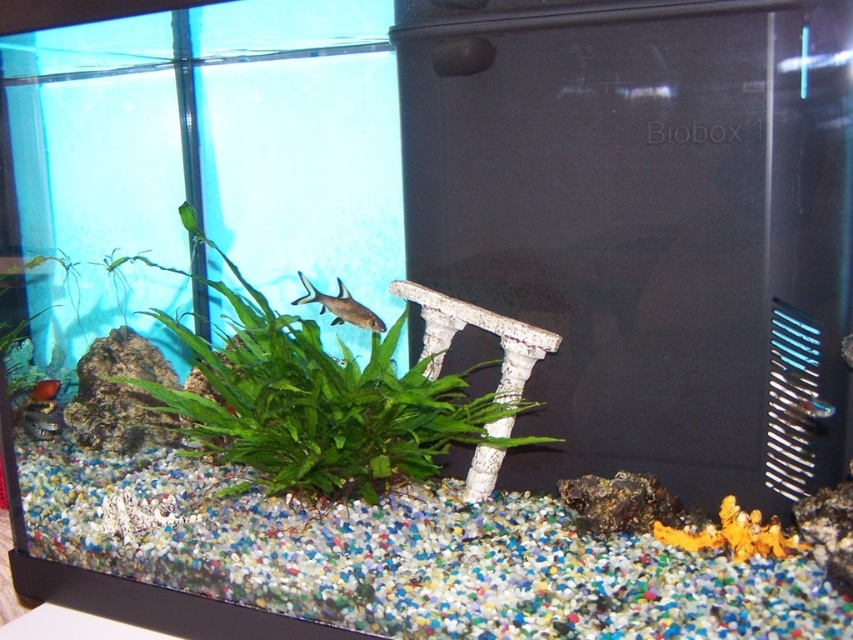
Who is higher up, green leafy plant at center or shiny silver fish at center?

shiny silver fish at center is higher up.

Which of these two, green leafy plant at center or shiny silver fish at center, stands taller?

green leafy plant at center

Between point (392, 385) and point (325, 307), which one is positioned in front?

Positioned in front is point (392, 385).

Where is `green leafy plant at center`? The height and width of the screenshot is (640, 853). green leafy plant at center is located at coordinates click(x=323, y=403).

Between point (300, 365) and point (115, 260), which one is positioned behind?

The point (115, 260) is more distant.

Is green leafy plant at center in front of green leafy plant at upper left?

Yes, green leafy plant at center is closer to the viewer.

The image size is (853, 640). What are the coordinates of `green leafy plant at center` in the screenshot? It's located at (323, 403).

Who is positioned more to the right, green leafy plant at center or translucent glass fish at center?

From the viewer's perspective, translucent glass fish at center appears more on the right side.

Is point (277, 458) more distant than point (819, 401)?

Yes, it is behind point (819, 401).

Image resolution: width=853 pixels, height=640 pixels. I want to click on green leafy plant at center, so [323, 403].